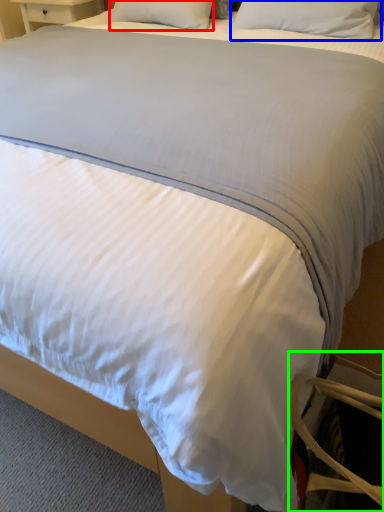
Question: Based on their relative distances, which object is nearer to pillow (highlighted by a red box)? Choose from pillow (highlighted by a blue box) and swivel chair (highlighted by a green box).

Choices:
 (A) pillow
 (B) swivel chair

Answer: (A)